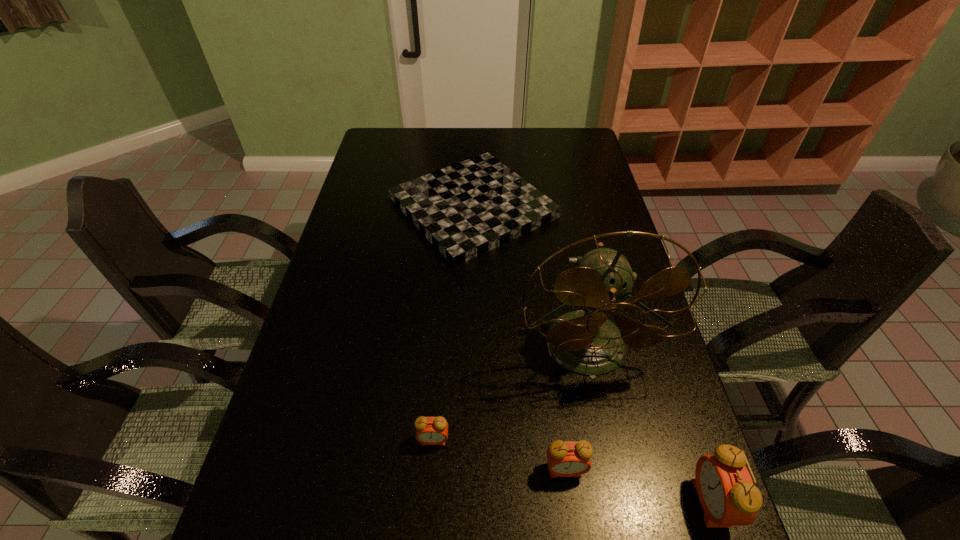
Locate an element on the screen. vacant area between the shortest object and the second tallest alarm clock is located at coordinates (519, 339).

Find the location of a particular element. vacant region between the fan and the leftmost alarm clock is located at coordinates (510, 393).

You are a GUI agent. You are given a task and a screenshot of the screen. Output one action in this format:
    pyautogui.click(x=<x>, y=<y>)
    Task: Click on the vacant space that is in between the fourth shortest object and the fourth nearest object
    
    Given the screenshot: What is the action you would take?
    pyautogui.click(x=648, y=424)

Locate which object ranks second in proximity to the second tallest alarm clock. Please provide its 2D coordinates. Your answer should be formatted as a tuple, i.e. [(x, y)], where the tuple contains the x and y coordinates of a point satisfying the conditions above.

[(429, 430)]

Identify which object is located as the fourth nearest to the tallest object. Please provide its 2D coordinates. Your answer should be formatted as a tuple, i.e. [(x, y)], where the tuple contains the x and y coordinates of a point satisfying the conditions above.

[(725, 488)]

Identify the location of alarm clock that is the closest to the tallest object. This screenshot has height=540, width=960. (565, 459).

What are the coordinates of `the second closest alarm clock to the fan` in the screenshot? It's located at point(429,430).